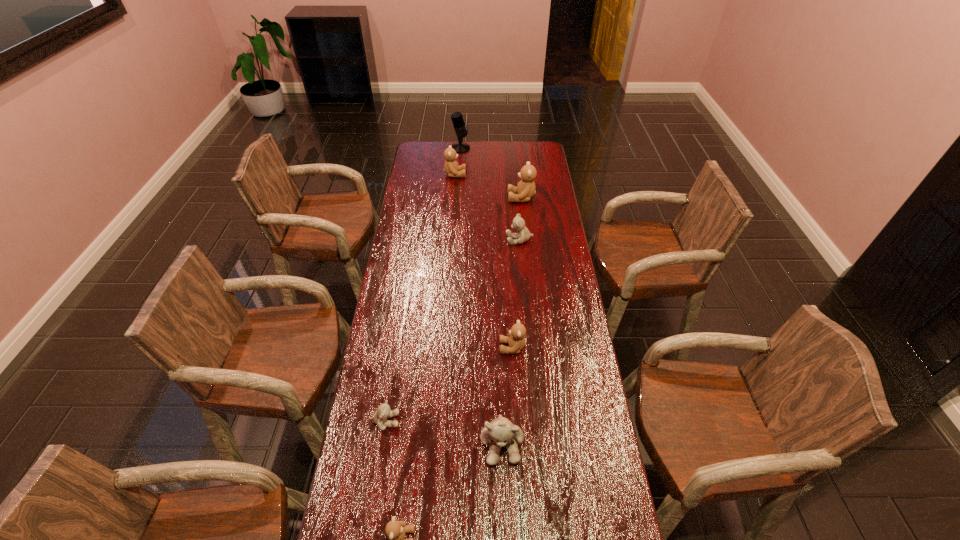
This screenshot has height=540, width=960. I want to click on vacant space at the right edge of the desktop, so click(552, 201).

Where is `free space at the far left corner of the desktop`? This screenshot has width=960, height=540. free space at the far left corner of the desktop is located at coordinates (421, 153).

This screenshot has height=540, width=960. I want to click on free space at the far right corner, so click(x=523, y=150).

The width and height of the screenshot is (960, 540). What are the coordinates of `vacant space in between the third nearest brown teddy bear and the microphone` in the screenshot? It's located at (491, 173).

What are the coordinates of `vacant space that is in between the farthest object and the fifth nearest object` in the screenshot? It's located at (490, 194).

This screenshot has height=540, width=960. I want to click on free spot between the third farthest object and the farthest object, so click(x=491, y=173).

The height and width of the screenshot is (540, 960). Identify the location of vacant point located between the third farthest teddy bear and the fourth nearest teddy bear. (516, 294).

Identify the location of free spot between the fourth nearest teddy bear and the farthest teddy bear. The width and height of the screenshot is (960, 540). (484, 261).

At what (x,y) coordinates should I click in order to perform the action: click on object that is the fifth closest one to the microphone. Please return your answer as a coordinate pair (x, y). Looking at the image, I should click on (383, 412).

Image resolution: width=960 pixels, height=540 pixels. I want to click on object that ranks as the second closest to the fifth farthest object, so click(x=383, y=412).